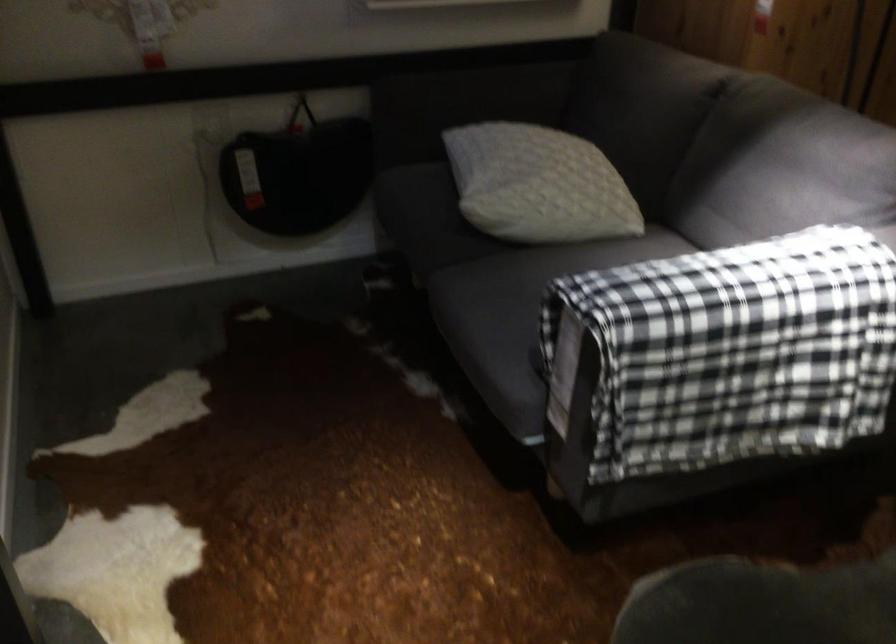
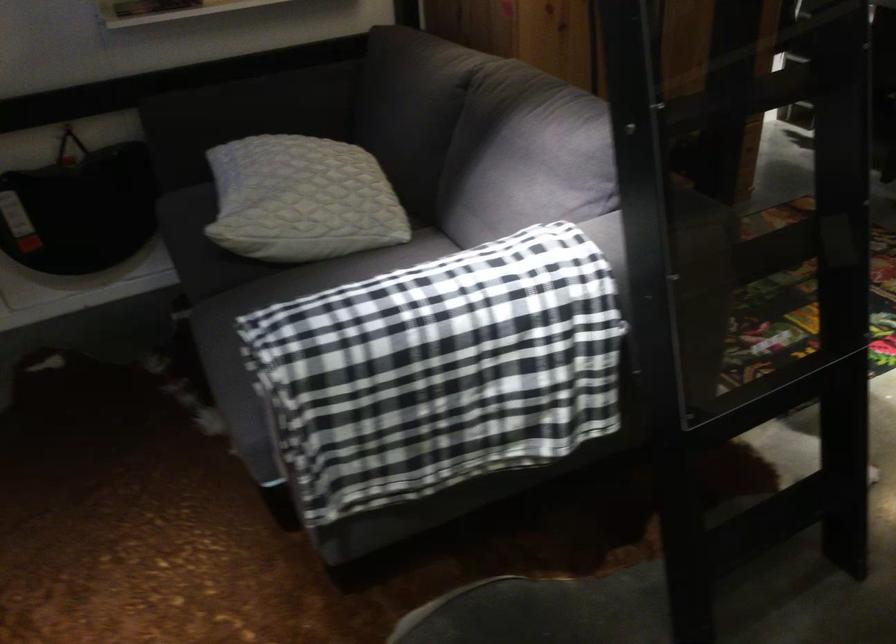
Question: Which direction would the cameraman need to move to produce the second image? Reply with the corresponding letter.

Choices:
 (A) Left
 (B) Right
 (C) Forward
 (D) Backward

Answer: (B)